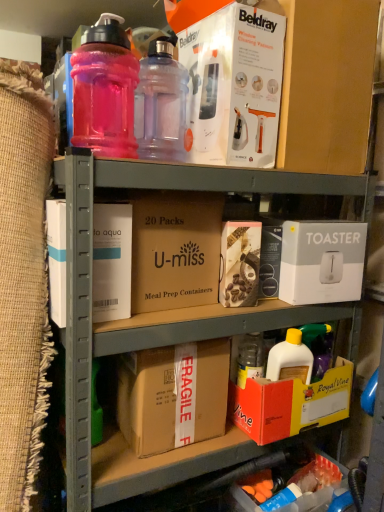
Question: Should I look upward or downward to see transparent plastic bottle at upper center, which is the 2th bottle in left-to-right order?

Choices:
 (A) up
 (B) down

Answer: (A)

Question: Which direction should I rotate to look at pink matte box at center, the 2th box in the top-to-bottom sequence?

Choices:
 (A) left
 (B) right

Answer: (B)

Question: Is transparent plastic bottle at upper center, which is the 2th bottle in left-to-right order, at the back of brown cardboard at center, placed as the 1th cardboard box when sorted from top to bottom?

Choices:
 (A) yes
 (B) no

Answer: (B)

Question: Can you confirm if brown cardboard at center, the 2th cardboard box ordered from the bottom, is positioned to the right of transparent plastic bottle at upper center, which is the 2th bottle in left-to-right order?

Choices:
 (A) yes
 (B) no

Answer: (B)

Question: Is brown cardboard at center, the 2th cardboard box ordered from the bottom, surrounding transparent plastic bottle at upper center, which is the 2th bottle in left-to-right order?

Choices:
 (A) yes
 (B) no

Answer: (B)

Question: Is brown cardboard at center, placed as the 1th cardboard box when sorted from top to bottom, placed right next to transparent plastic bottle at upper center, which is the 2th bottle in left-to-right order?

Choices:
 (A) yes
 (B) no

Answer: (B)

Question: Does brown cardboard at center, placed as the 1th cardboard box when sorted from top to bottom, have a smaller size compared to transparent plastic bottle at upper center, which is the 2th bottle in left-to-right order?

Choices:
 (A) yes
 (B) no

Answer: (B)

Question: Is brown cardboard at center, the 2th cardboard box ordered from the bottom, located outside transparent plastic bottle at upper center, which is the 2th bottle in left-to-right order?

Choices:
 (A) no
 (B) yes

Answer: (B)

Question: Is orange cardboard box at lower right, the fourth box when ordered from top to bottom, oriented towards transparent plastic bottle at upper center, positioned as the 1th bottle in right-to-left order?

Choices:
 (A) no
 (B) yes

Answer: (A)

Question: Is orange cardboard box at lower right, the fourth box when ordered from top to bottom, further to the viewer compared to transparent plastic bottle at upper center, positioned as the 1th bottle in right-to-left order?

Choices:
 (A) no
 (B) yes

Answer: (B)

Question: Considering the relative sizes of orange cardboard box at lower right, which is counted as the second box, starting from the bottom, and transparent plastic bottle at upper center, which is the 2th bottle in left-to-right order, in the image provided, is orange cardboard box at lower right, which is counted as the second box, starting from the bottom, wider than transparent plastic bottle at upper center, which is the 2th bottle in left-to-right order,?

Choices:
 (A) no
 (B) yes

Answer: (B)

Question: Is orange cardboard box at lower right, which is counted as the second box, starting from the bottom, looking in the opposite direction of transparent plastic bottle at upper center, positioned as the 1th bottle in right-to-left order?

Choices:
 (A) no
 (B) yes

Answer: (A)

Question: Is orange cardboard box at lower right, which is counted as the second box, starting from the bottom, to the left of transparent plastic bottle at upper center, positioned as the 1th bottle in right-to-left order, from the viewer's perspective?

Choices:
 (A) yes
 (B) no

Answer: (B)

Question: Can you confirm if orange cardboard box at lower right, which is counted as the second box, starting from the bottom, is taller than transparent plastic bottle at upper center, which is the 2th bottle in left-to-right order?

Choices:
 (A) yes
 (B) no

Answer: (B)

Question: Does orange cardboard box at lower right, which is counted as the second box, starting from the bottom, lie behind orange cardboard box at lower right, which is the 5th box from top to bottom?

Choices:
 (A) yes
 (B) no

Answer: (B)